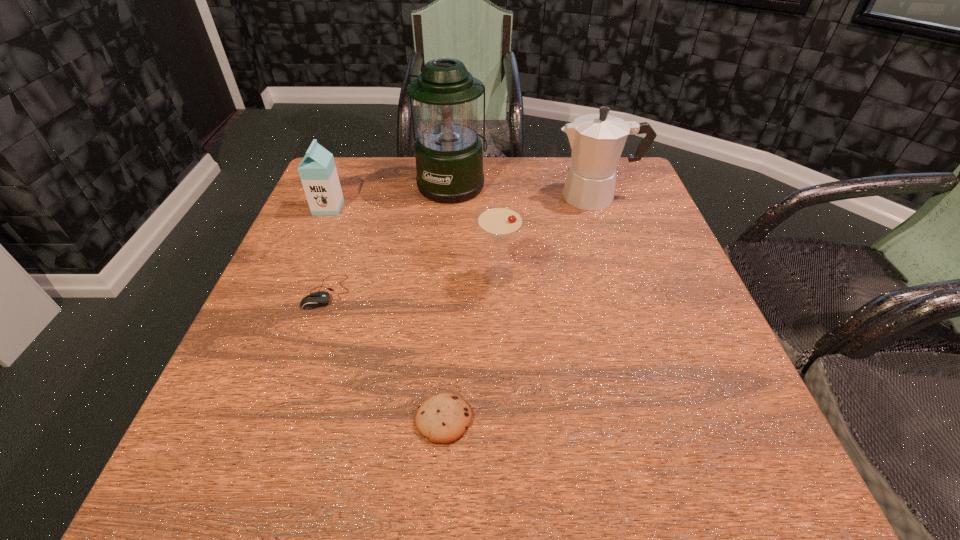
The width and height of the screenshot is (960, 540). In order to click on vacant area located at the spout of the fifth shortest object in this screenshot , I will do `click(421, 197)`.

The height and width of the screenshot is (540, 960). In order to click on vacant space located 0.290m on the front of the milk carton in this screenshot , I will do `click(290, 299)`.

Locate an element on the screen. The image size is (960, 540). blank space located 0.330m on the front of the martini is located at coordinates (505, 447).

Locate an element on the screen. The width and height of the screenshot is (960, 540). free space located on the left of the cookie is located at coordinates (328, 419).

I want to click on vacant space located on the back of the computer mouse, so click(x=363, y=189).

Locate an element on the screen. This screenshot has height=540, width=960. lantern that is at the far edge is located at coordinates (449, 159).

You are a GUI agent. You are given a task and a screenshot of the screen. Output one action in this format:
    pyautogui.click(x=<x>, y=<y>)
    Task: Click on the coffeepot at the far edge
    The width and height of the screenshot is (960, 540).
    Given the screenshot: What is the action you would take?
    [597, 140]

Locate an element on the screen. milk carton situated at the far edge is located at coordinates (318, 173).

Find the location of a particular element. The height and width of the screenshot is (540, 960). object that is at the near edge is located at coordinates (443, 418).

In order to click on milk carton that is at the left edge in this screenshot , I will do `click(318, 173)`.